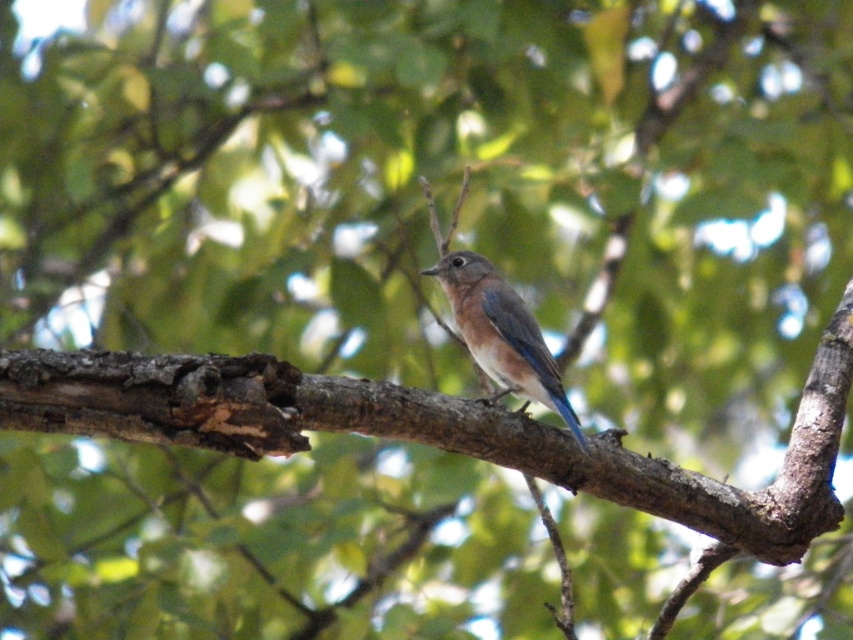
You are a photographer aiming to capture the brown rough tree branch at center in your shot. The camera sensor can only focus on objects within a 0.5 unit radius around the center point at coordinates 0.5, 0.5. Will the branch be in focus?

The brown rough tree branch at center is at point (434,429), which is outside the 0.5 unit radius from the center point (426,320). Therefore, the branch will not be in focus.